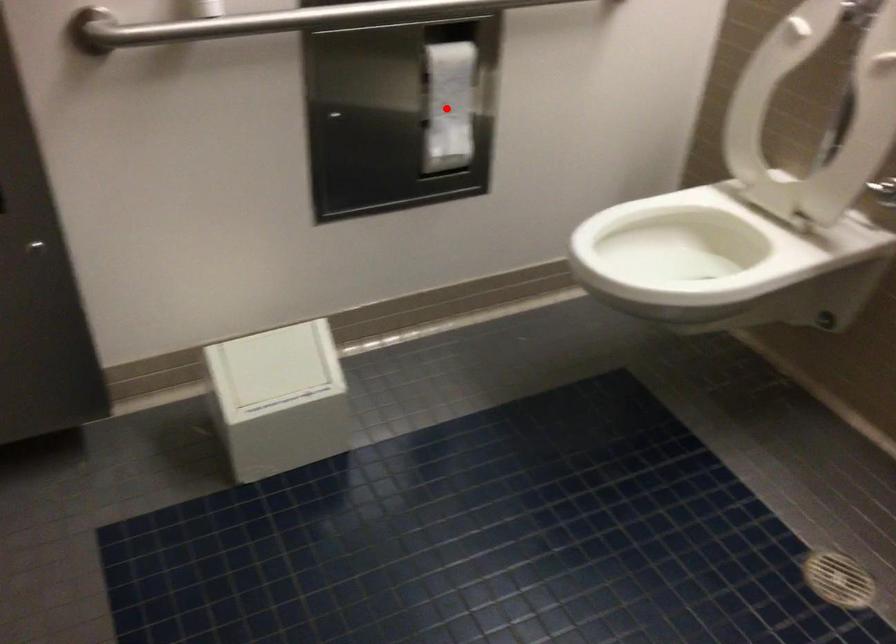
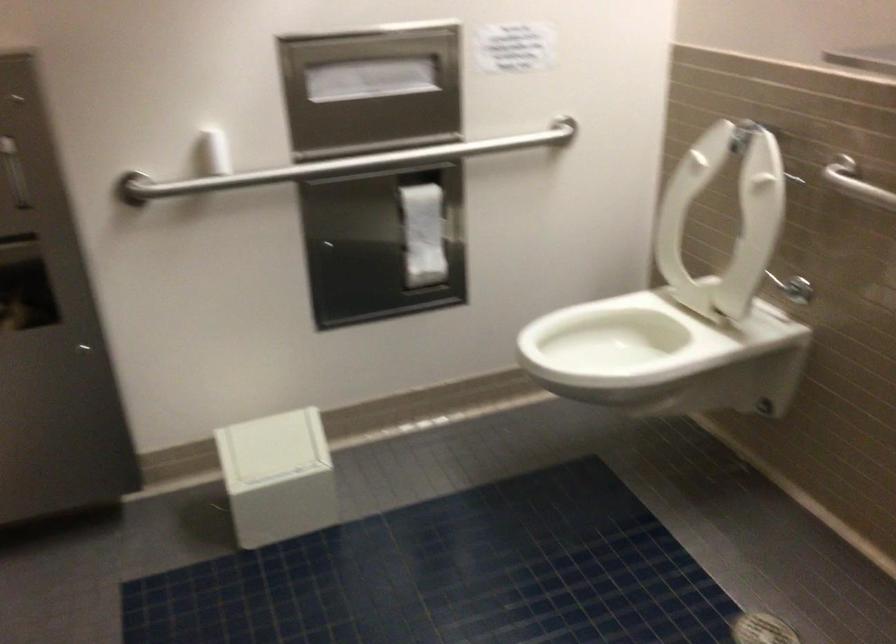
Question: I am providing you with two images of the same scene from different viewpoints. Image1 has a red point marked. In image2, the corresponding 3D location appears at what relative position? Reply with the corresponding letter.

Choices:
 (A) Closer
 (B) Farther

Answer: (B)